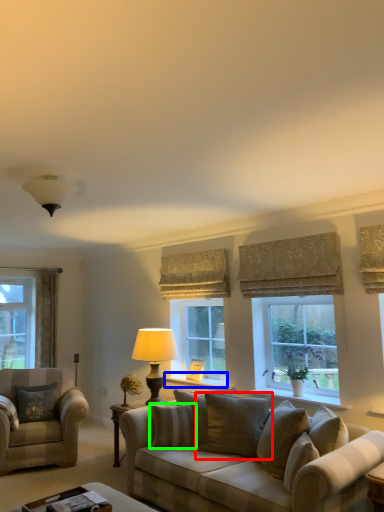
Question: Estimate the real-world distances between objects in this image. Which object is farther from pillow (highlighted by a red box), window sill (highlighted by a blue box) or pillow (highlighted by a green box)?

Choices:
 (A) window sill
 (B) pillow

Answer: (A)